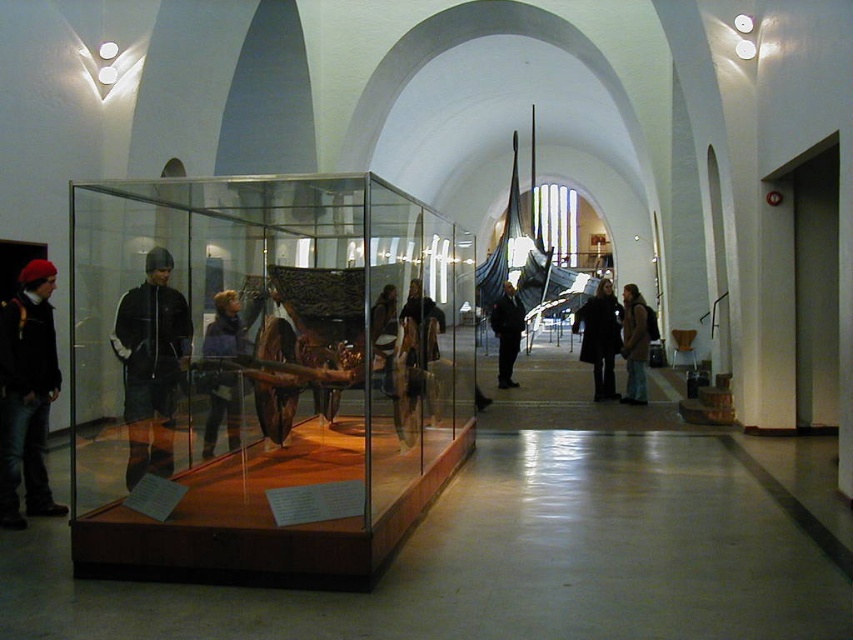
You are a museum security guard who needs to determine which jacket is more likely to be a thinner material. You see both the matte black jacket at left and the black fabric jacket at left. Which one is thinner?

The matte black jacket at left is thinner than the black fabric jacket at left according to the description.

You are a visitor in the museum and you want to compare the jackets you see. Which jacket is larger in size between the black fabric jacket at left and the blue fuzzy jacket at center?

The black fabric jacket at left is bigger than the blue fuzzy jacket at center.

You are a visitor in the museum and want to take a photo of the transparent glass boat at center without any reflections from the glass panels. Where should you stand relative to the boat?

The transparent glass boat at center is located at point (260, 376), so you should stand directly in front of it to minimize reflections from the glass panels.